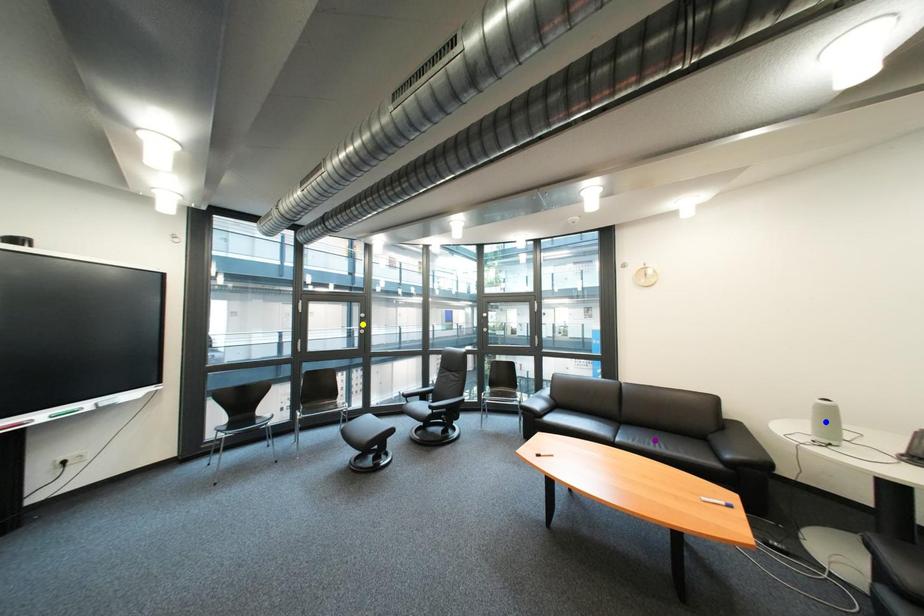
Order these from nearest to farthest:
purple point, yellow point, blue point

blue point < purple point < yellow point